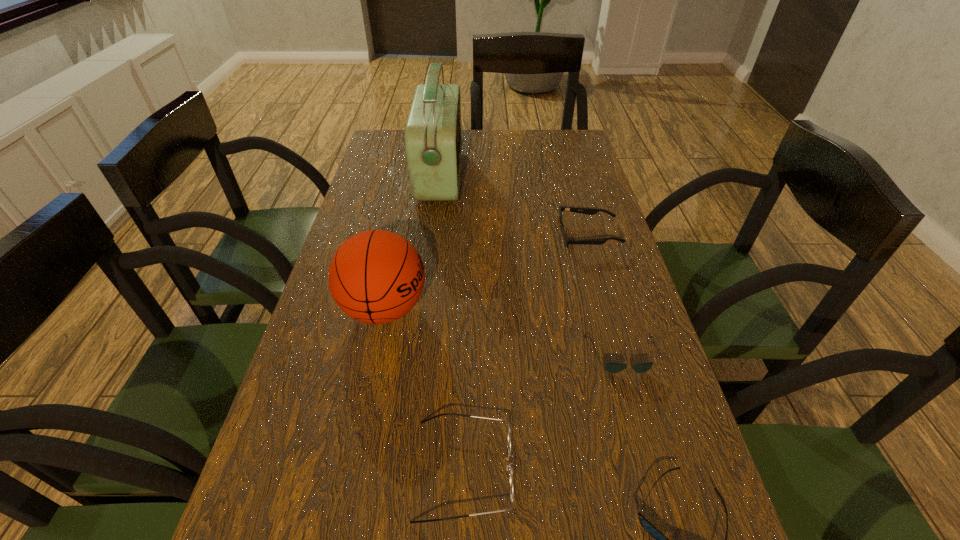
I want to click on the farthest object, so click(x=433, y=140).

Find the location of a particular element. The image size is (960, 540). the tallest object is located at coordinates (433, 140).

You are a GUI agent. You are given a task and a screenshot of the screen. Output one action in this format:
    pyautogui.click(x=<x>, y=<y>)
    Task: Click on the fifth shortest object
    This screenshot has width=960, height=540.
    Given the screenshot: What is the action you would take?
    tap(376, 276)

Locate an element on the screen. spectacles is located at coordinates (509, 432).

Find the location of a particular element. the second farthest object is located at coordinates (588, 211).

This screenshot has height=540, width=960. I want to click on the fourth tallest object, so click(588, 211).

This screenshot has width=960, height=540. I want to click on the second farthest sunglasses, so click(611, 367).

This screenshot has height=540, width=960. Find the location of `vacant space located on the front panel of the tallest object`. vacant space located on the front panel of the tallest object is located at coordinates (538, 176).

Identify the location of vacant space located 0.280m on the side with logo of the basketball. The width and height of the screenshot is (960, 540). (551, 308).

You are a GUI agent. You are given a task and a screenshot of the screen. Output one action in this format:
    pyautogui.click(x=<x>, y=<y>)
    Task: Click on the free space located 0.200m through the lenses of the spectacles
    
    Given the screenshot: What is the action you would take?
    pyautogui.click(x=632, y=469)